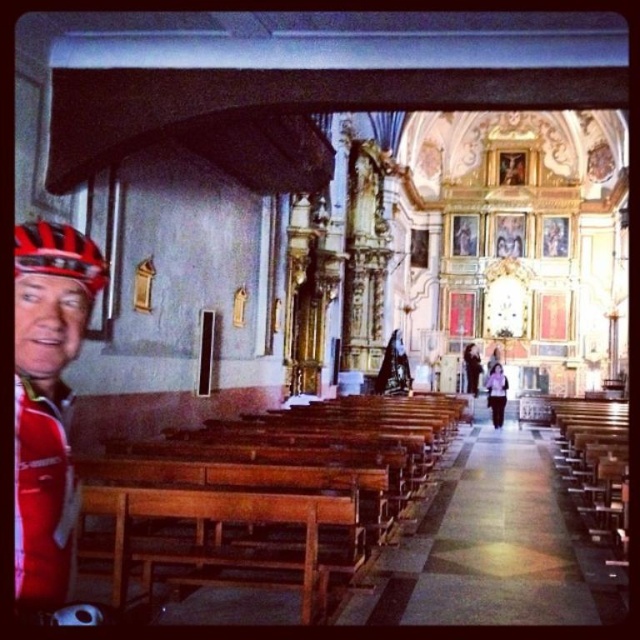
Who is higher up, shiny red helmet at left or black leather jacket at center?

shiny red helmet at left is higher up.

Does point (58, 253) come behind point (476, 392)?

No, (58, 253) is closer to viewer.

At what (x,y) coordinates should I click in order to perform the action: click on shiny red helmet at left. Please return your answer as a coordinate pair (x, y). Looking at the image, I should click on (58, 253).

Can you confirm if red matte helmet at left is smaller than shiny red helmet at left?

No, red matte helmet at left is not smaller than shiny red helmet at left.

Does red matte helmet at left appear over shiny red helmet at left?

Actually, red matte helmet at left is below shiny red helmet at left.

This screenshot has width=640, height=640. Describe the element at coordinates (48, 401) in the screenshot. I see `red matte helmet at left` at that location.

Where is `red matte helmet at left`? Image resolution: width=640 pixels, height=640 pixels. red matte helmet at left is located at coordinates (48, 401).

Is shiny red helmet at left to the right of purple fabric at center from the viewer's perspective?

Incorrect, shiny red helmet at left is not on the right side of purple fabric at center.

Is point (36, 260) farther from camera compared to point (497, 412)?

No.

Locate an element on the screen. Image resolution: width=640 pixels, height=640 pixels. shiny red helmet at left is located at coordinates coord(58,253).